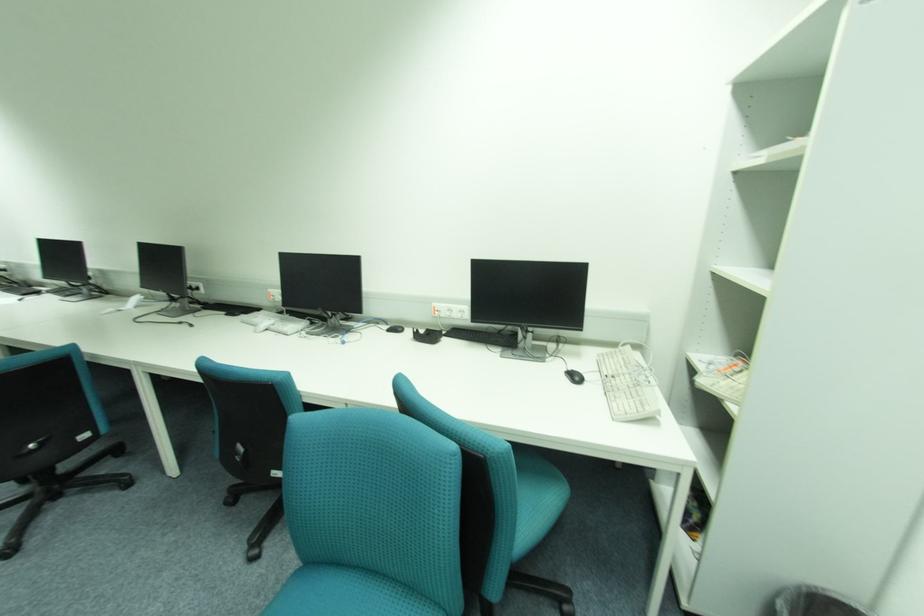
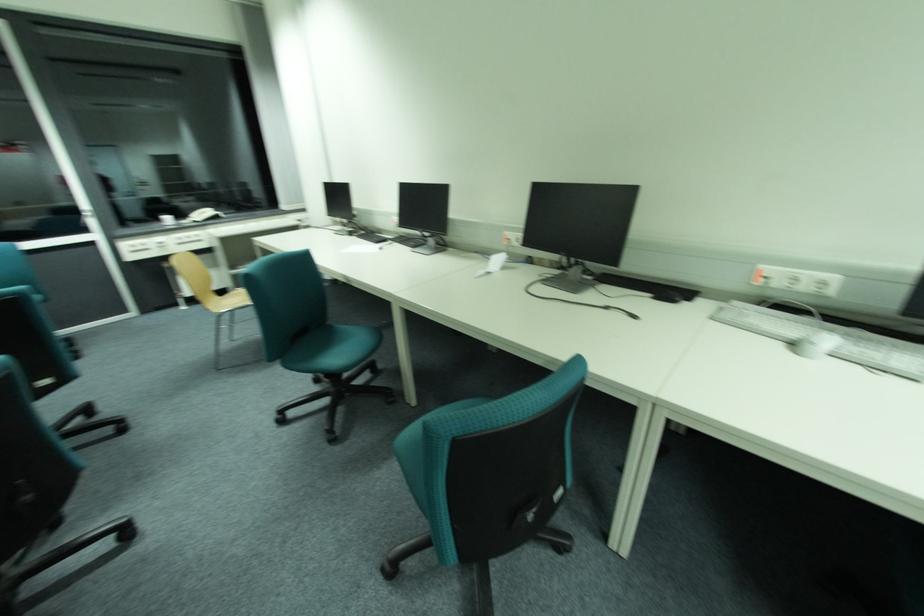
The point at (116, 310) is marked in the first image. Where is the corresponding point in the second image?

(487, 272)